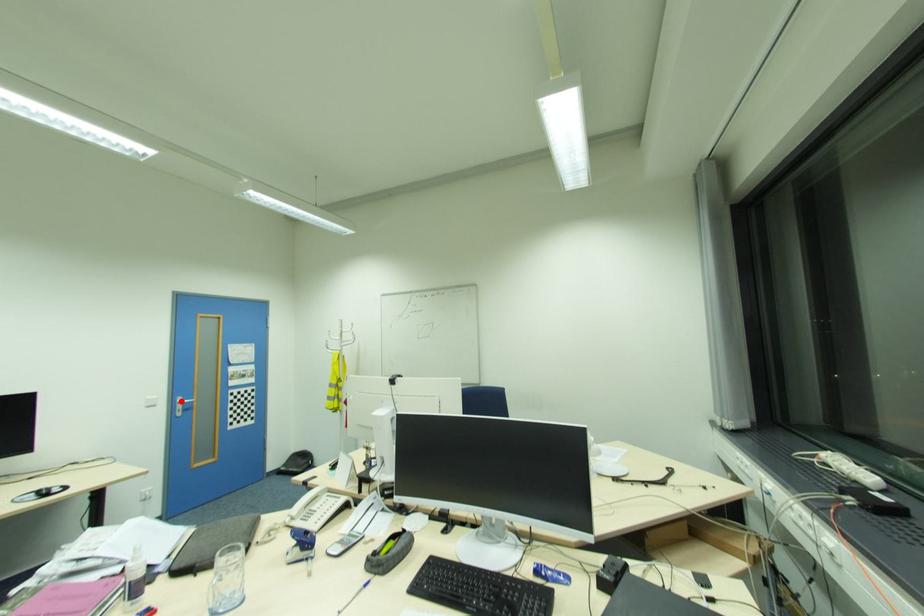
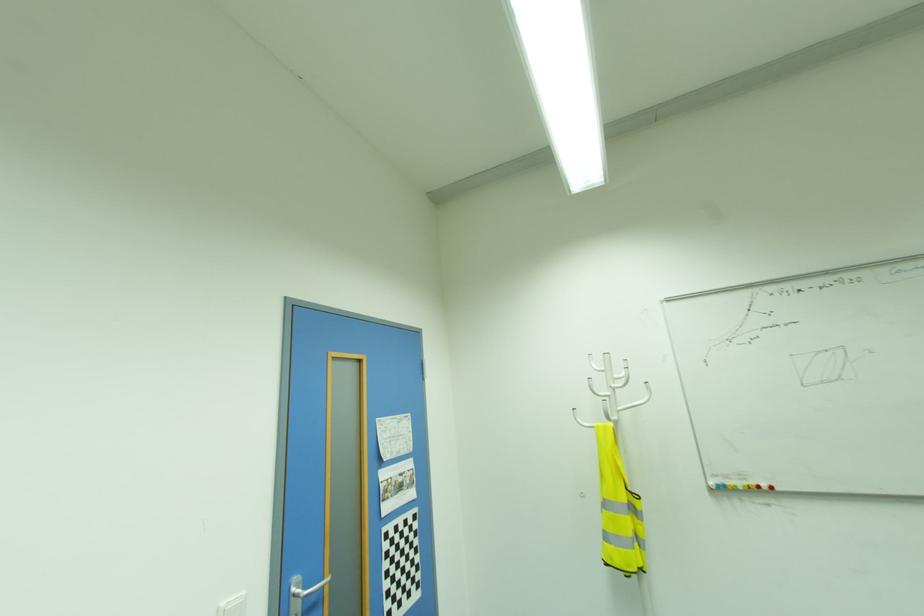
Find the pixel in the second image that matches the highlighted location in the first image.

(296, 590)